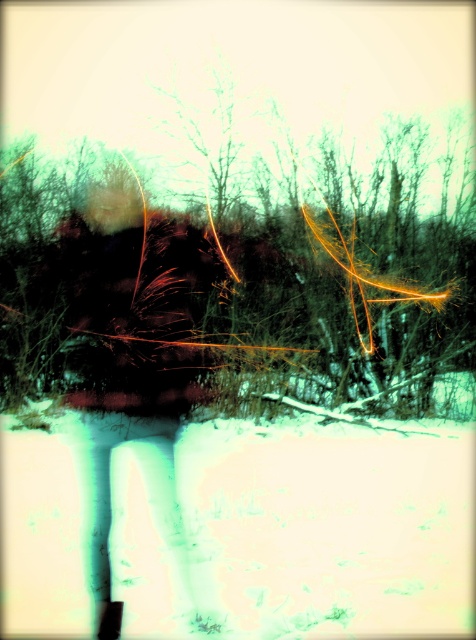
Question: Based on their relative distances, which object is nearer to the translucent plastic bag at center?

Choices:
 (A) smooth brown tree trunk at center
 (B) white powdery snow at lower center

Answer: (A)

Question: Does white powdery snow at lower center have a lesser width compared to translucent plastic bag at center?

Choices:
 (A) no
 (B) yes

Answer: (B)

Question: From the image, what is the correct spatial relationship of smooth brown tree trunk at center in relation to white powdery snow at lower center?

Choices:
 (A) below
 (B) above

Answer: (B)

Question: Which object appears closest to the camera in this image?

Choices:
 (A) translucent plastic bag at center
 (B) white powdery snow at lower center

Answer: (A)

Question: Which of the following is the farthest from the observer?

Choices:
 (A) white powdery snow at lower center
 (B) smooth brown tree trunk at center

Answer: (A)

Question: Does white powdery snow at lower center come behind translucent plastic bag at center?

Choices:
 (A) no
 (B) yes

Answer: (B)